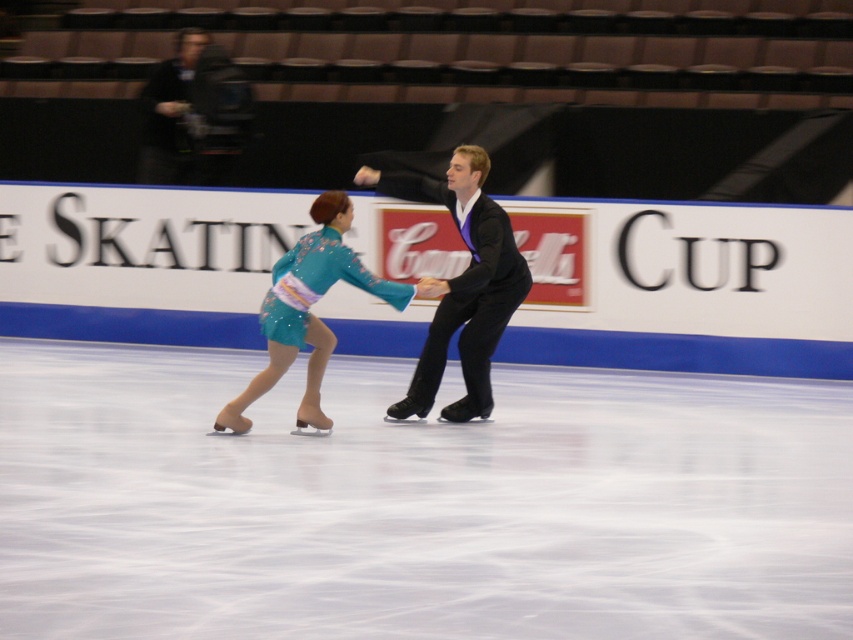
You are a photographer at the skating competition. You need to capture a photo where the white smooth ice at center is clearly visible below the teal satin dress at center. Is this possible based on their positions?

Yes, because the white smooth ice at center is lower than the teal satin dress at center, allowing the ice to be seen beneath the dress.